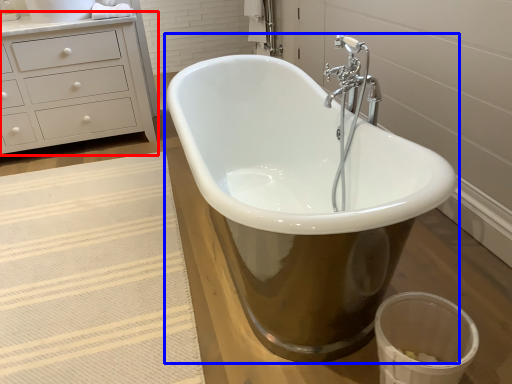
Question: Which object is closer to the camera taking this photo, chest of drawers (highlighted by a red box) or bathtub (highlighted by a blue box)?

Choices:
 (A) chest of drawers
 (B) bathtub

Answer: (B)